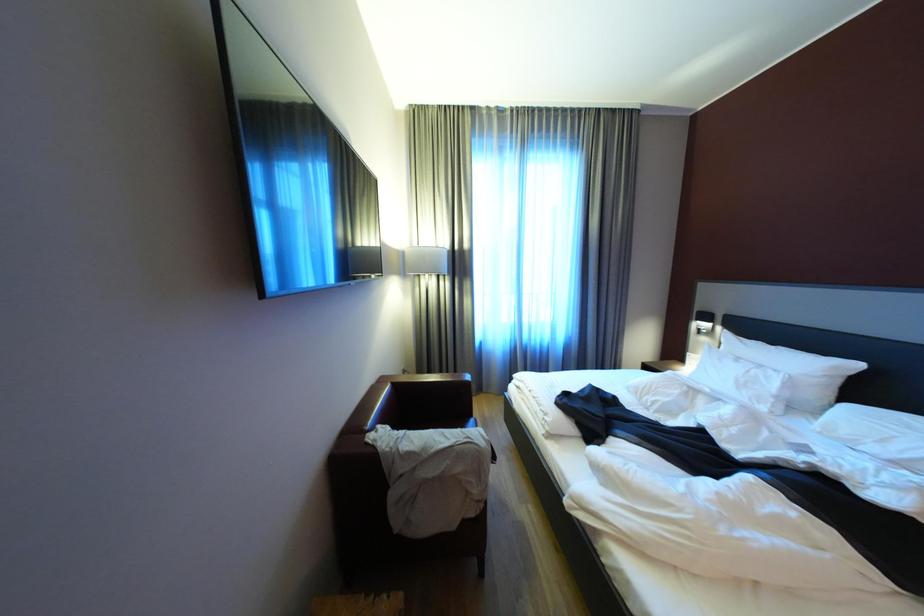
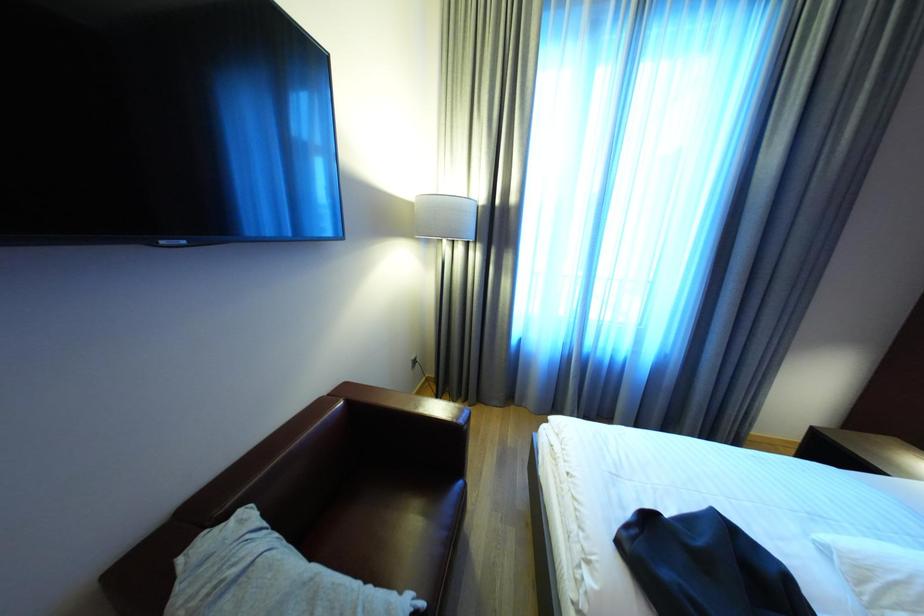
Question: The images are taken continuously from a first-person perspective. In which direction are you moving?

Choices:
 (A) Left
 (B) Right
 (C) Forward
 (D) Backward

Answer: (C)